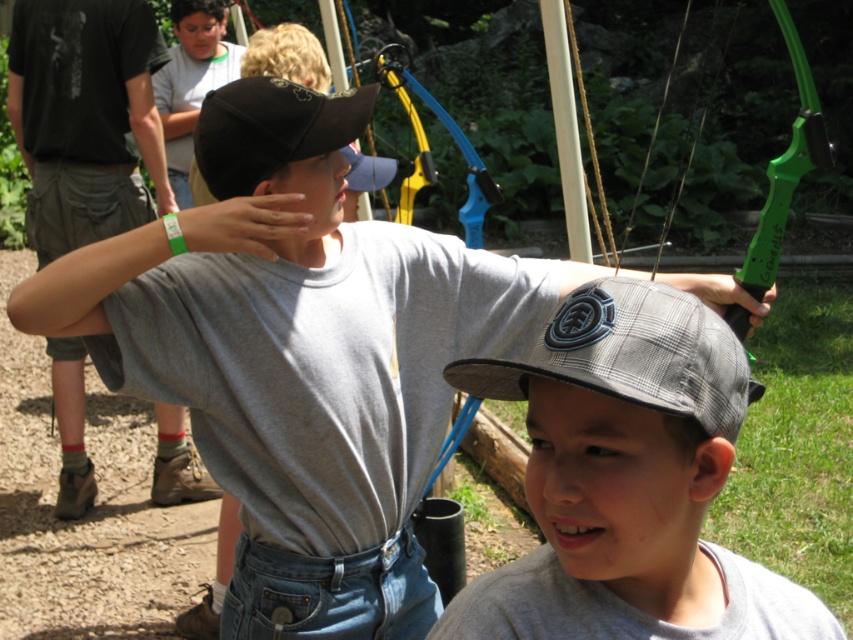
You are an archer preparing to shoot an arrow. You notice two caps in your line of sight. The gray checkered cap at center and the black matte baseball cap at upper center. Which cap is closer to you?

The gray checkered cap at center is closer to you since it is 34.40 inches away from the black matte baseball cap at upper center.

You are an archer preparing to shoot an arrow. You notice two caps in your line of sight. The gray checkered cap at center and the plaid fabric baseball cap at center. Which cap is located lower in your view?

The gray checkered cap at center is positioned under the plaid fabric baseball cap at center, so the gray checkered cap at center is lower in your view.

You are an archer standing at the center of the field. You need to place a 2 inch wide arrow on the ground between the gray checkered cap at center and the plaid fabric baseball cap at center. Will the arrow fit between them?

The distance between the gray checkered cap at center and the plaid fabric baseball cap at center is 1.99 inches. Since the arrow is 2 inches wide, it will not fit between them as the space is slightly smaller than the arrow.